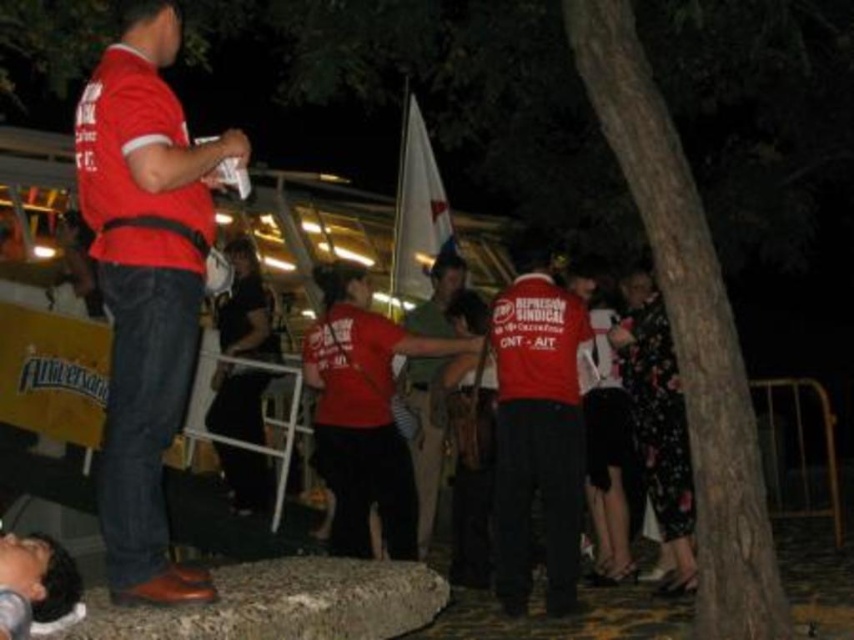
Question: Can you confirm if matte red shirt at left is wider than matte red shirt at center?

Choices:
 (A) no
 (B) yes

Answer: (A)

Question: Which object appears farthest from the camera in this image?

Choices:
 (A) matte red shirt at left
 (B) matte red shirt at center

Answer: (B)

Question: Among these points, which one is nearest to the camera?

Choices:
 (A) (512, 356)
 (B) (141, 160)

Answer: (B)

Question: Does matte red shirt at left appear on the left side of matte red shirt at center?

Choices:
 (A) no
 (B) yes

Answer: (B)

Question: Is matte red shirt at left closer to the viewer compared to matte red shirt at center?

Choices:
 (A) yes
 (B) no

Answer: (A)

Question: Which point is closer to the camera?

Choices:
 (A) (524, 595)
 (B) (151, 556)

Answer: (B)